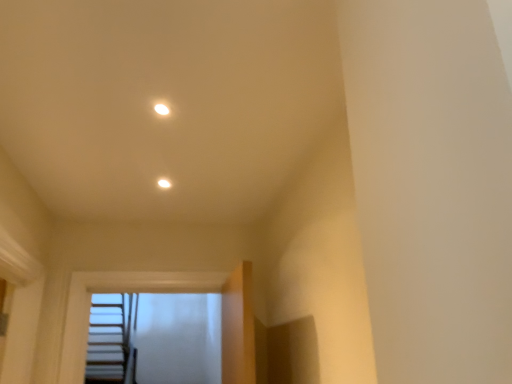
The height and width of the screenshot is (384, 512). I want to click on white glossy light fixture at upper center, so click(161, 109).

What do you see at coordinates (161, 109) in the screenshot? I see `white glossy light fixture at upper center` at bounding box center [161, 109].

Identify the location of white glossy light fixture at upper center. This screenshot has width=512, height=384. (161, 109).